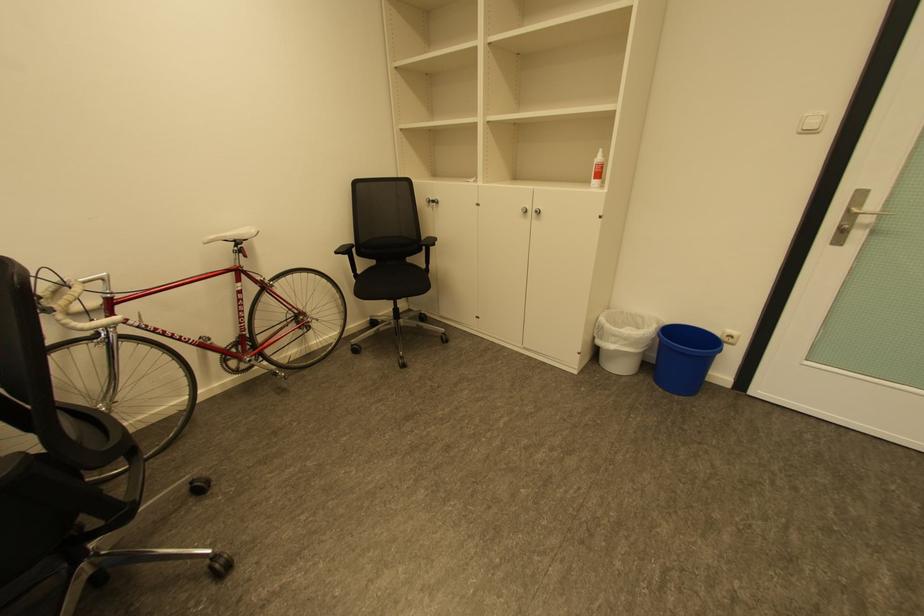
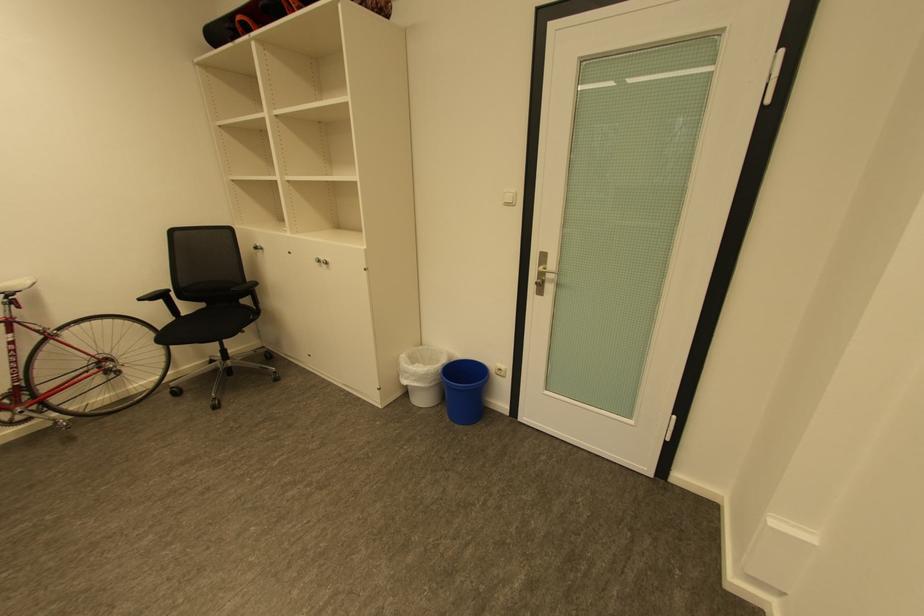
Locate, in the second image, the point that corresponds to (440,201) in the first image.

(262, 248)